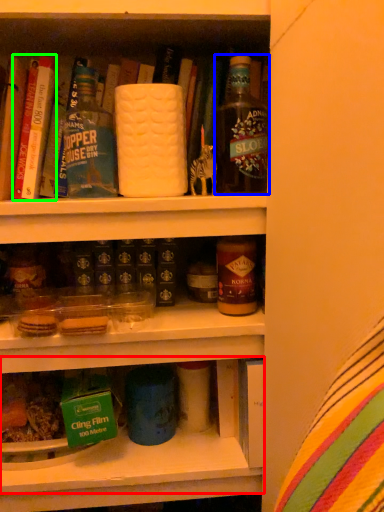
Question: Based on their relative distances, which object is nearer to shelf (highlighted by a red box)? Choose from bottle (highlighted by a blue box) and book (highlighted by a green box).

Choices:
 (A) bottle
 (B) book

Answer: (A)